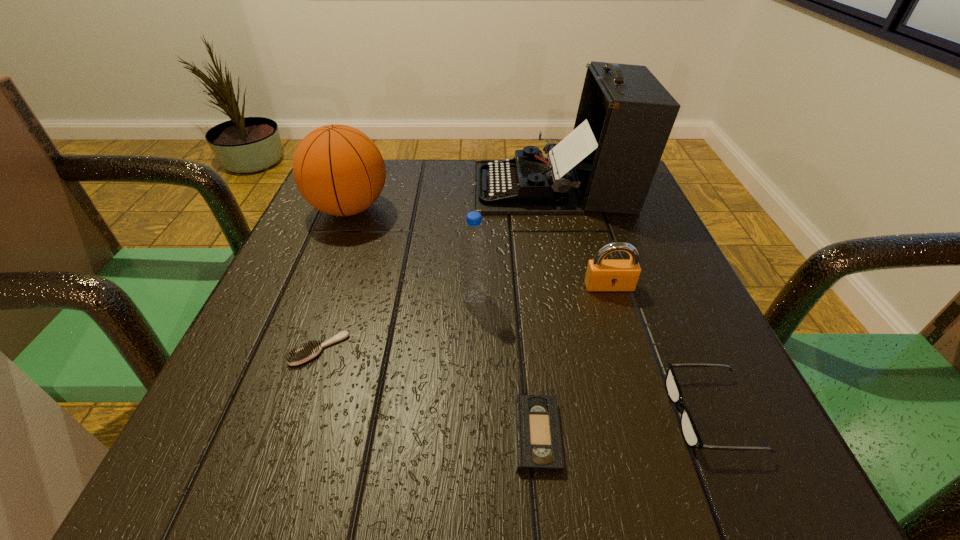
Find the location of a particular element. The width and height of the screenshot is (960, 540). vacant space that is in between the third shortest object and the fourth shortest object is located at coordinates (660, 350).

The image size is (960, 540). In order to click on vacant area that lies between the videotape and the padlock in this screenshot , I will do point(573,360).

Locate an element on the screen. The height and width of the screenshot is (540, 960). free space between the spectacles and the shortest object is located at coordinates pos(624,424).

I want to click on vacant space in between the tallest object and the fourth shortest object, so click(x=582, y=237).

At what (x,y) coordinates should I click in order to perform the action: click on object that stands as the fifth closest to the water bottle. Please return your answer as a coordinate pair (x, y). Image resolution: width=960 pixels, height=540 pixels. Looking at the image, I should click on (338, 169).

Identify which object is the sixth closest to the padlock. Please provide its 2D coordinates. Your answer should be formatted as a tuple, i.e. [(x, y)], where the tuple contains the x and y coordinates of a point satisfying the conditions above.

[(338, 169)]

This screenshot has width=960, height=540. In order to click on blank area in the image that satisfies the following two spatial constraints: 1. on the front-facing side of the spectacles; 2. on the front side of the shortest object in this screenshot , I will do `click(720, 434)`.

Find the location of a particular element. The image size is (960, 540). vacant position in the image that satisfies the following two spatial constraints: 1. inside the open case of the typewriter; 2. on the front side of the scrubbing brush is located at coordinates (592, 349).